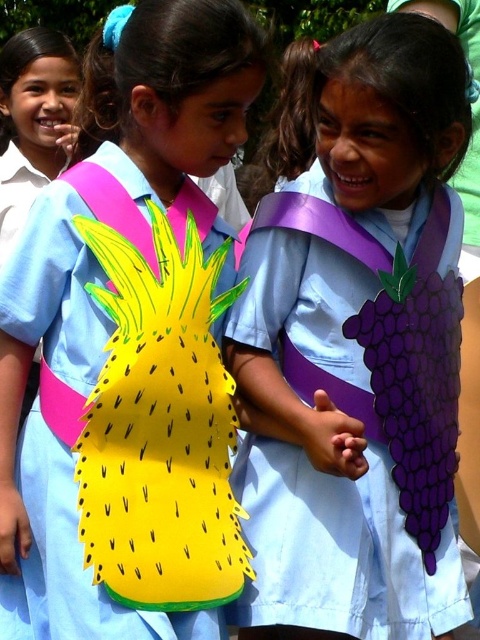
Question: Does yellow paper pineapple at center have a lesser width compared to purple matte grapevine at center?

Choices:
 (A) no
 (B) yes

Answer: (B)

Question: Among these objects, which one is nearest to the camera?

Choices:
 (A) yellow paper pineapple at center
 (B) purple matte grapevine at center

Answer: (A)

Question: Is yellow paper pineapple at center smaller than purple matte grapevine at center?

Choices:
 (A) no
 (B) yes

Answer: (A)

Question: Is yellow paper pineapple at center positioned at the back of purple matte grapevine at center?

Choices:
 (A) no
 (B) yes

Answer: (A)